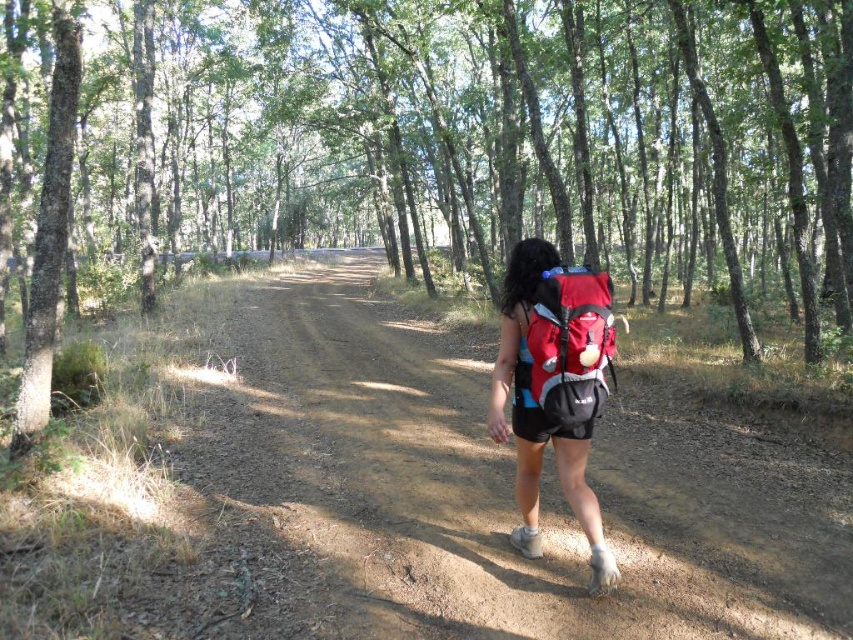
Question: Where is matte red backpack at center located in relation to red matte backpack at center in the image?

Choices:
 (A) right
 (B) left

Answer: (B)

Question: Which of these objects is positioned closest to the brown bark tree at center?

Choices:
 (A) matte red backpack at center
 (B) brown dirt track at center
 (C) red matte backpack at center

Answer: (B)

Question: Among these points, which one is nearest to the camera?

Choices:
 (A) (247, 458)
 (B) (581, 387)
 (C) (47, 264)

Answer: (B)

Question: Which point is farther to the camera?

Choices:
 (A) (529, 400)
 (B) (138, 84)

Answer: (B)

Question: Is brown bark tree at center to the left of brown dirt track at center from the viewer's perspective?

Choices:
 (A) yes
 (B) no

Answer: (B)

Question: Does brown bark tree at center have a larger size compared to red matte backpack at center?

Choices:
 (A) no
 (B) yes

Answer: (B)